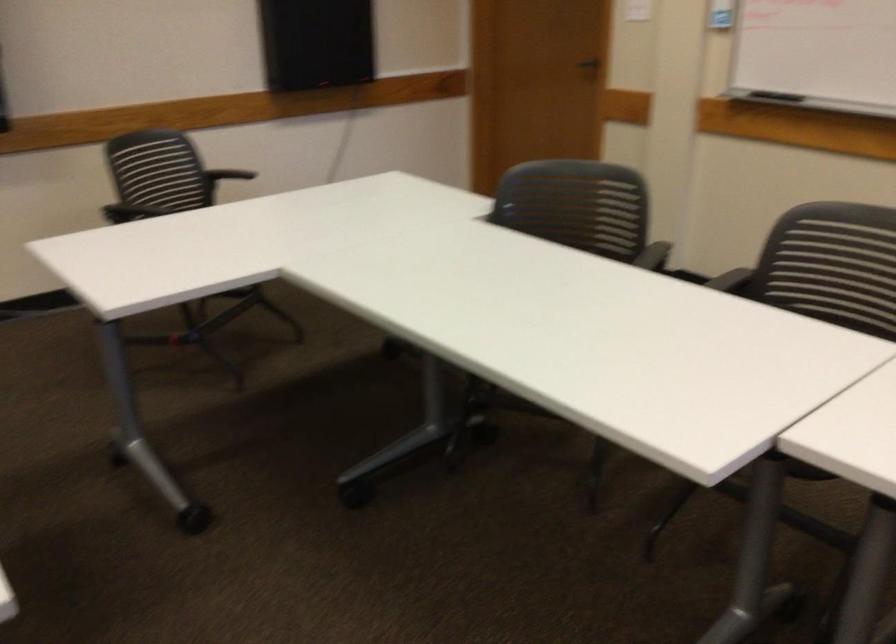
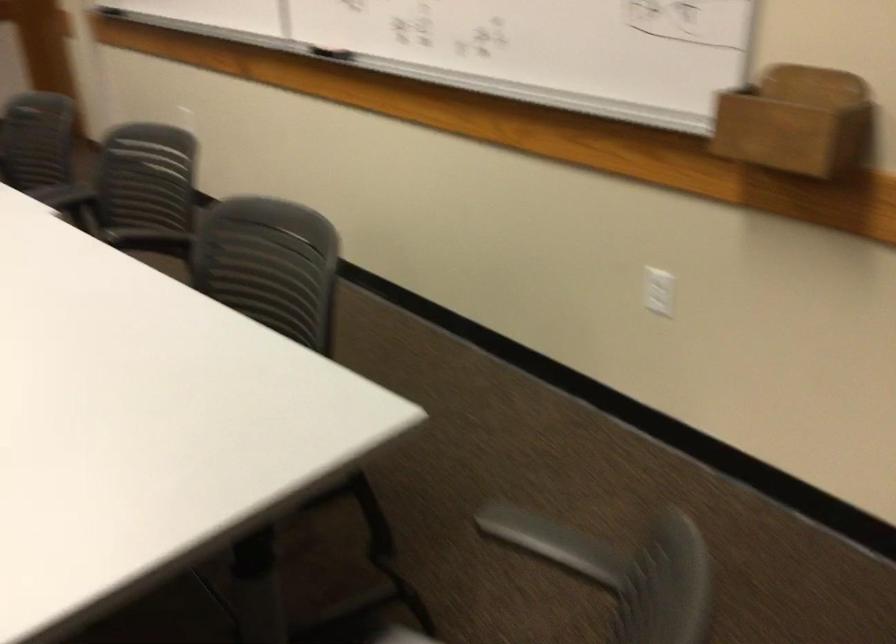
The images are taken continuously from a first-person perspective. In which direction are you moving?

The cameraman moved toward right, backward.